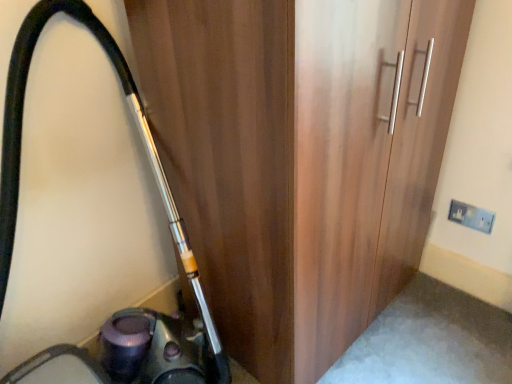
Question: Based on their positions, is metallic vacuum cleaner at left located to the left or right of wooden wardrobe at center?

Choices:
 (A) left
 (B) right

Answer: (A)

Question: In the image, is metallic vacuum cleaner at left positioned in front of or behind wooden wardrobe at center?

Choices:
 (A) front
 (B) behind

Answer: (A)

Question: Which object is the farthest from the white plastic electric outlet at upper right?

Choices:
 (A) wooden wardrobe at center
 (B) metallic vacuum cleaner at left

Answer: (B)

Question: Which object is positioned farthest from the wooden wardrobe at center?

Choices:
 (A) white plastic electric outlet at upper right
 (B) metallic vacuum cleaner at left

Answer: (A)